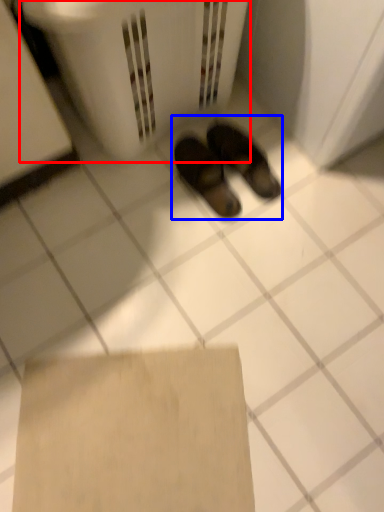
Question: Which object appears farthest to the camera in this image, laundry basket (highlighted by a red box) or footwear (highlighted by a blue box)?

Choices:
 (A) laundry basket
 (B) footwear

Answer: (B)